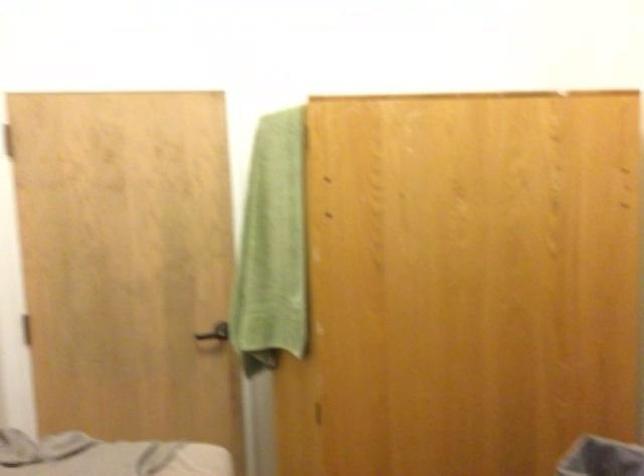
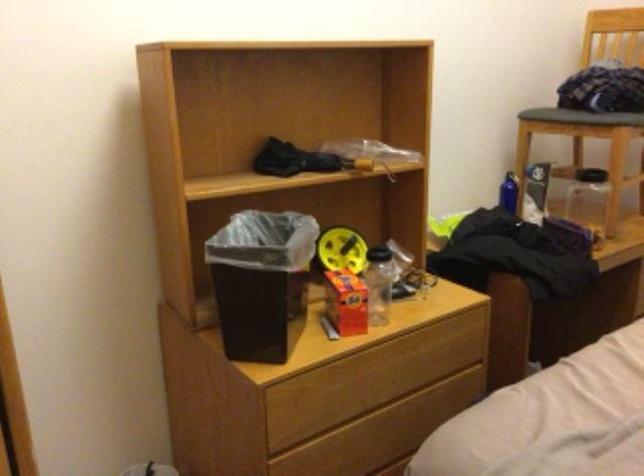
Question: I am providing you with two images of the same scene from different viewpoints. After the viewpoint changes to image2, which objects are now occluded?

Choices:
 (A) black conference speaker
 (B) gray trash can
 (C) clear plastic bottle
 (D) wooden drawer handle

Answer: (B)